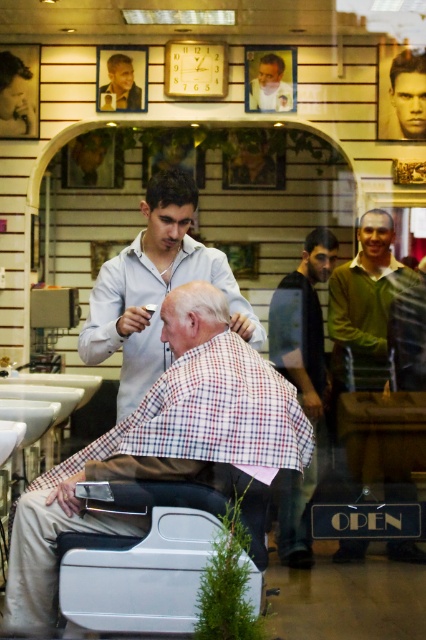
Question: Does checkered fabric shirt at center have a lesser width compared to dark brown hair at upper left?

Choices:
 (A) yes
 (B) no

Answer: (B)

Question: Does green sweater at center appear over smooth skin face at upper right?

Choices:
 (A) no
 (B) yes

Answer: (A)

Question: Among these points, which one is nearest to the camera?

Choices:
 (A) (5, 83)
 (B) (408, 61)

Answer: (B)

Question: Is checkered fabric shirt at center below plaid shirt at center?

Choices:
 (A) yes
 (B) no

Answer: (B)

Question: Considering the real-world distances, which object is farthest from the dark brown hair at upper left?

Choices:
 (A) green sweater at center
 (B) dark brown hair at center
 (C) smooth brown hair at center

Answer: (A)

Question: Among these points, which one is nearest to the camera?

Choices:
 (A) [157, 307]
 (B) [264, 60]
 (C) [8, 67]

Answer: (A)